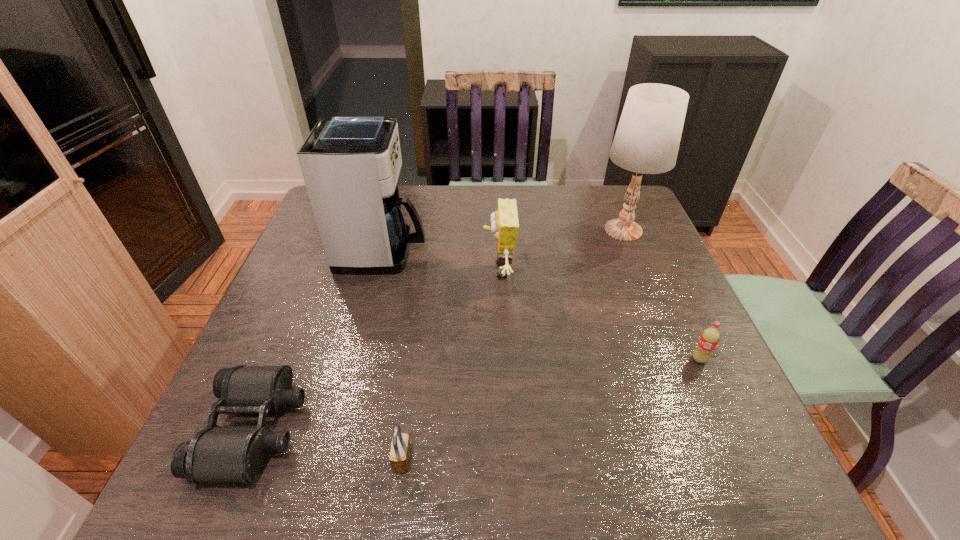
This screenshot has width=960, height=540. What are the coordinates of `free space that satisfies the following two spatial constraints: 1. on the face of the soda; 2. on the right side of the third object from right to left` in the screenshot? It's located at (503, 359).

The image size is (960, 540). I want to click on vacant position in the image that satisfies the following two spatial constraints: 1. on the face of the soda; 2. on the right side of the third tallest object, so click(x=503, y=359).

Identify the location of vacant region that satisfies the following two spatial constraints: 1. on the front panel of the fourth farthest object; 2. on the left side of the coffee maker. (355, 359).